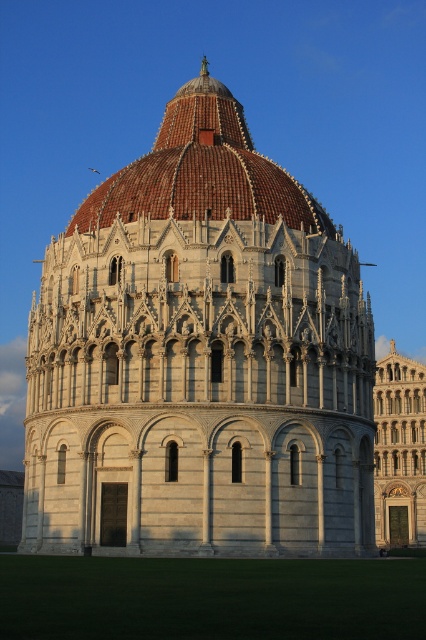
You are standing in the Piazza dei Miracoli looking at the Pisa Baptistery. There are two points marked on the dome of the Baptistery. The first point is at coordinates point (281, 188), and the second point is at point (412, 424). Which point is closer to your current position?

Point (281, 188) is closer to the camera than point (412, 424), so the first point is closer to your current position.

You are an architect analyzing the Pisa Baptistery. You observe the white stone tower at center and the brown tiled dome at center. Based on their positions, which structure would cast a larger shadow during midday when the sun is directly overhead?

The white stone tower at center might be wider than brown tiled dome at center, so it would cast a larger shadow during midday when the sun is directly overhead.

You are standing in the Piazza dei Miracoli and want to take a photo of both the brown tiled dome at center and the golden stone tower at center. Which object should you focus on first to ensure both are in the frame?

You should focus on the brown tiled dome at center first because it is closer to you than the golden stone tower at center, ensuring both are in the frame by adjusting the camera angle accordingly.